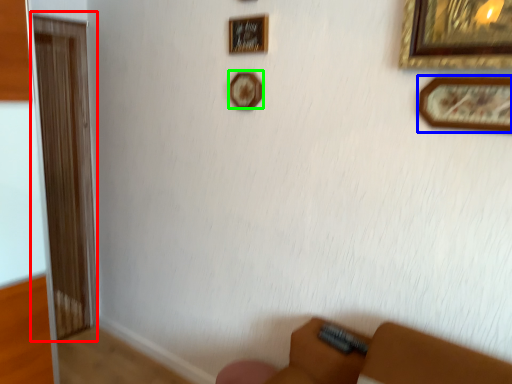
Question: Which is nearer to the screen door (highlighted by a red box)? picture frame (highlighted by a blue box) or picture frame (highlighted by a green box).

Choices:
 (A) picture frame
 (B) picture frame

Answer: (B)